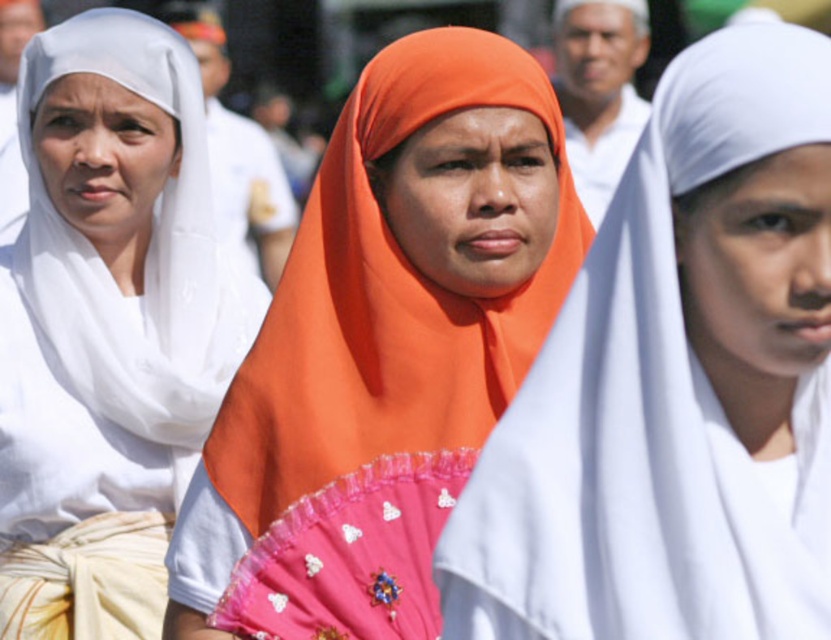
You are a photographer adjusting your camera settings to capture the scene. You want to ensure that both the white matte veil at center and the white matte scarf at left are in focus. Given their positions, is it possible to have both in focus without changing your camera settings?

The white matte veil at center is in front of the white matte scarf at left, so adjusting the focus to the middle distance between them might allow both to be in focus. However, this depends on the lens aperture and the depth of field. If the current settings provide sufficient depth of field, it could work, but if not, you might need to adjust the aperture for a smaller opening to increase depth of field.

You are standing at the point with coordinates point (470, 291) and want to move to the point with coordinates point (499, 605). Given the layout of the scene described, will you pass in front of any of the three women in the foreground during your path?

Yes, you will pass in front of the woman on the right since point (499, 605) is in front of point (470, 291).

Consider the image. You are standing in the crowd at this event and notice two points marked in the image. The first point is at coordinates point (x=542, y=100) and the second is at point (x=40, y=99). Which point is closer to you?

Point (x=542, y=100) is in front of point (x=40, y=99), so the first point is closer to you.